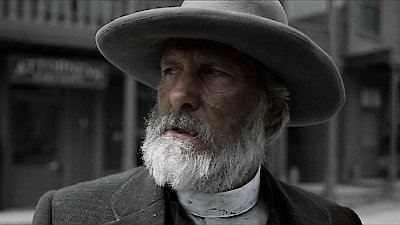
Image resolution: width=400 pixels, height=225 pixels. I want to click on coat, so click(x=115, y=198).